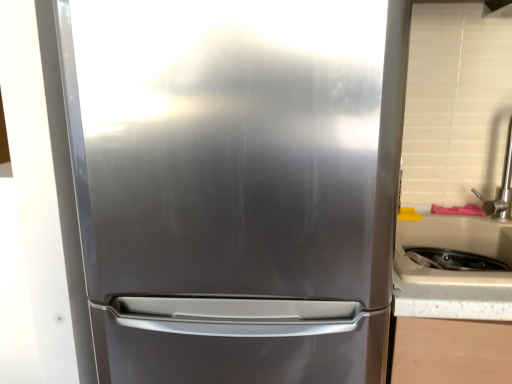
Question: Should I look upward or downward to see brushed metal exhaust hood at upper right?

Choices:
 (A) down
 (B) up

Answer: (B)

Question: Considering the relative sizes of satin nickel faucet at right and white speckled laminate at right in the image provided, is satin nickel faucet at right thinner than white speckled laminate at right?

Choices:
 (A) yes
 (B) no

Answer: (A)

Question: From the image's perspective, is satin nickel faucet at right located beneath white speckled laminate at right?

Choices:
 (A) no
 (B) yes

Answer: (A)

Question: Is satin nickel faucet at right shorter than white speckled laminate at right?

Choices:
 (A) yes
 (B) no

Answer: (B)

Question: Does satin nickel faucet at right have a smaller size compared to white speckled laminate at right?

Choices:
 (A) no
 (B) yes

Answer: (B)

Question: From a real-world perspective, is satin nickel faucet at right over white speckled laminate at right?

Choices:
 (A) no
 (B) yes

Answer: (B)

Question: Can you see satin nickel faucet at right touching white speckled laminate at right?

Choices:
 (A) no
 (B) yes

Answer: (A)

Question: From a real-world perspective, is satin nickel faucet at right beneath stainless steel refrigerator at center?

Choices:
 (A) no
 (B) yes

Answer: (A)

Question: Does satin nickel faucet at right turn towards stainless steel refrigerator at center?

Choices:
 (A) no
 (B) yes

Answer: (A)

Question: Is stainless steel refrigerator at center at the back of satin nickel faucet at right?

Choices:
 (A) no
 (B) yes

Answer: (A)

Question: From a real-world perspective, is satin nickel faucet at right positioned over stainless steel refrigerator at center based on gravity?

Choices:
 (A) yes
 (B) no

Answer: (A)

Question: Considering the relative positions of satin nickel faucet at right and stainless steel refrigerator at center in the image provided, is satin nickel faucet at right to the right of stainless steel refrigerator at center from the viewer's perspective?

Choices:
 (A) yes
 (B) no

Answer: (A)

Question: Can stainless steel refrigerator at center be found inside satin nickel faucet at right?

Choices:
 (A) no
 (B) yes

Answer: (A)

Question: Are white speckled laminate at right and brushed metal exhaust hood at upper right beside each other?

Choices:
 (A) yes
 (B) no

Answer: (B)